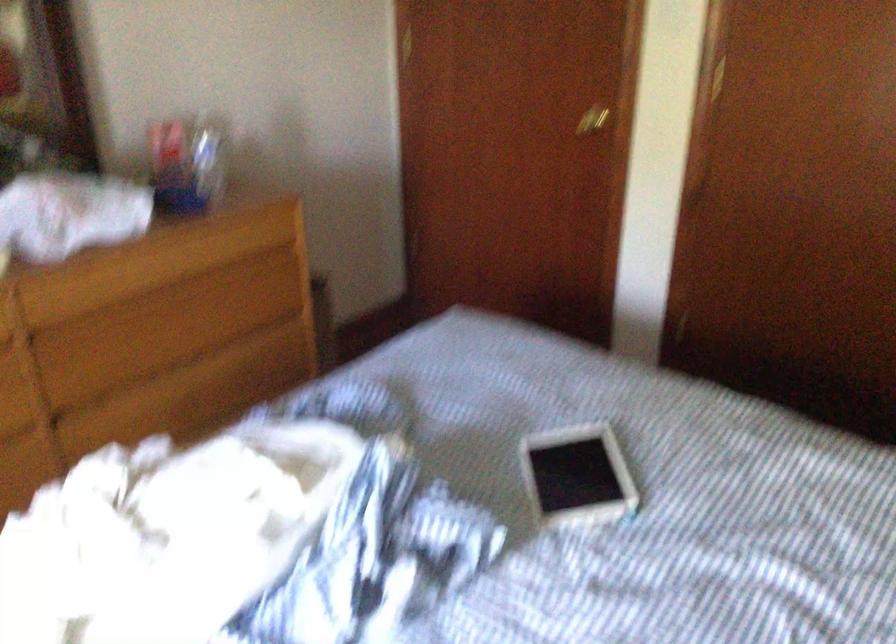
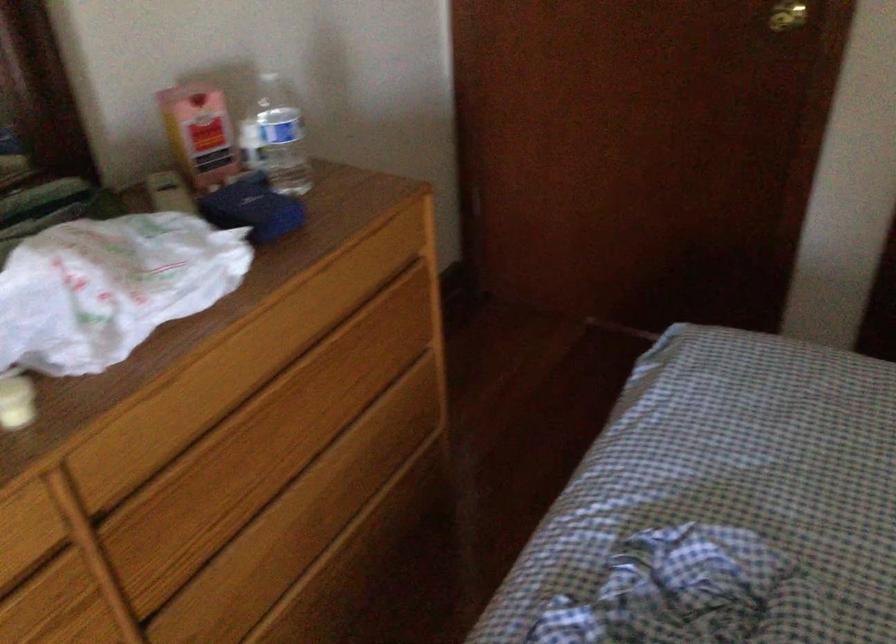
Locate, in the second image, the point that corresponds to (166,153) in the first image.

(200, 134)